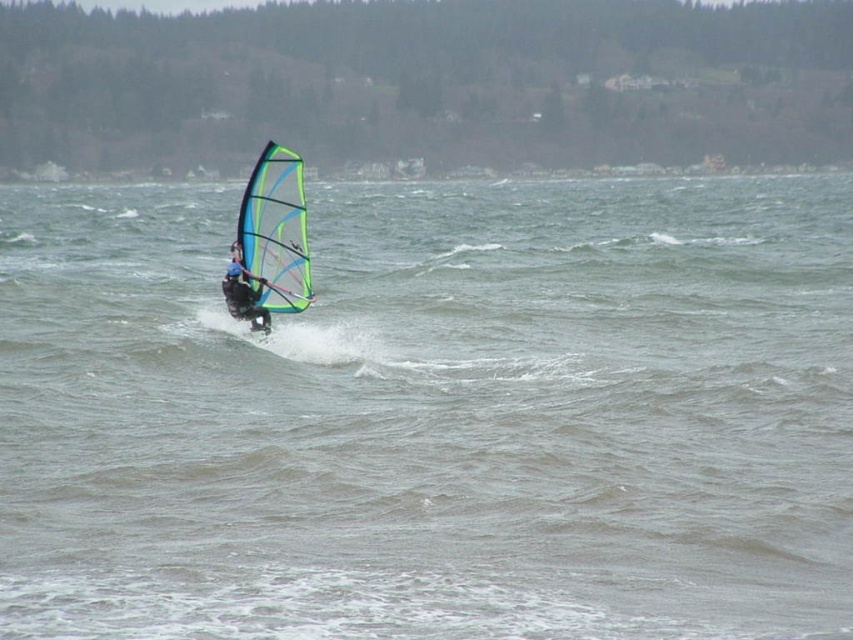
Question: Does clear water at center appear over blue matte windsurfer at center?

Choices:
 (A) no
 (B) yes

Answer: (B)

Question: In this image, where is clear water at center located relative to translucent blue-green sail at center?

Choices:
 (A) above
 (B) below

Answer: (A)

Question: Which object is positioned farthest from the translucent blue-green sail at center?

Choices:
 (A) blue matte windsurfer at center
 (B) clear water at center

Answer: (B)

Question: Among these points, which one is nearest to the camera?

Choices:
 (A) (235, 298)
 (B) (282, 160)
 (C) (653, 248)

Answer: (B)

Question: Which point is closer to the camera?

Choices:
 (A) blue matte windsurfer at center
 (B) clear water at center

Answer: (B)

Question: Is clear water at center positioned before blue matte windsurfer at center?

Choices:
 (A) yes
 (B) no

Answer: (A)